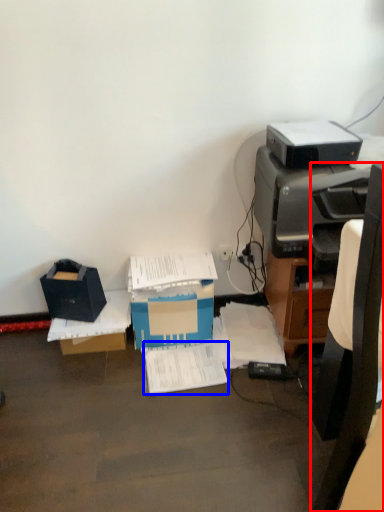
Question: Which object is closer to the camera taking this photo, chair (highlighted by a red box) or document (highlighted by a blue box)?

Choices:
 (A) chair
 (B) document

Answer: (A)